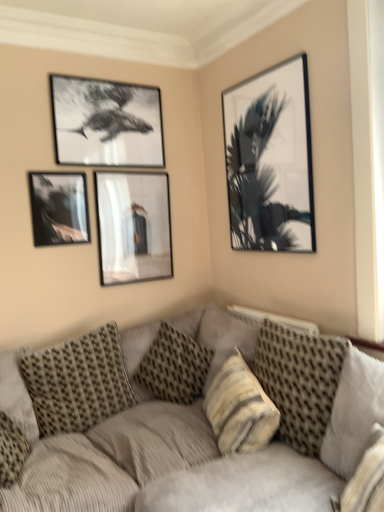
Question: From the image's perspective, would you say textured beige pillow at lower left, which is the fifth pillow from right to left, is positioned over patterned fabric pillow at center, positioned as the third pillow in right-to-left order?

Choices:
 (A) yes
 (B) no

Answer: (B)

Question: Is textured beige pillow at lower left, arranged as the first pillow when viewed from the left, in front of patterned fabric pillow at center, which ranks as the third pillow in left-to-right order?

Choices:
 (A) no
 (B) yes

Answer: (B)

Question: Can you confirm if textured beige pillow at lower left, arranged as the first pillow when viewed from the left, is smaller than patterned fabric pillow at center, which ranks as the third pillow in left-to-right order?

Choices:
 (A) no
 (B) yes

Answer: (B)

Question: From a real-world perspective, is textured beige pillow at lower left, arranged as the first pillow when viewed from the left, physically above patterned fabric pillow at center, which ranks as the third pillow in left-to-right order?

Choices:
 (A) no
 (B) yes

Answer: (B)

Question: Is patterned fabric pillow at center, which ranks as the third pillow in left-to-right order, completely or partially inside textured beige pillow at lower left, arranged as the first pillow when viewed from the left?

Choices:
 (A) no
 (B) yes

Answer: (A)

Question: In terms of size, does black matte picture frame at upper right, which appears as the first picture frame when viewed from the right, appear bigger or smaller than matte glass picture frame at center, which appears as the third picture frame when viewed from the left?

Choices:
 (A) big
 (B) small

Answer: (A)

Question: Looking at their shapes, would you say black matte picture frame at upper right, which appears as the first picture frame when viewed from the right, is wider or thinner than matte glass picture frame at center, which appears as the third picture frame when viewed from the left?

Choices:
 (A) thin
 (B) wide

Answer: (B)

Question: From a real-world perspective, is black matte picture frame at upper right, which is the fourth picture frame from left to right, above or below matte glass picture frame at center, which appears as the third picture frame when viewed from the left?

Choices:
 (A) below
 (B) above

Answer: (B)

Question: Is black matte picture frame at upper right, which appears as the first picture frame when viewed from the right, taller or shorter than matte glass picture frame at center, which appears as the third picture frame when viewed from the left?

Choices:
 (A) short
 (B) tall

Answer: (B)

Question: Based on their sizes in the image, would you say matte glass picture frame at center, placed as the second picture frame when sorted from right to left, is bigger or smaller than patterned fabric pillow at center, positioned as the third pillow in right-to-left order?

Choices:
 (A) small
 (B) big

Answer: (A)

Question: Is matte glass picture frame at center, placed as the second picture frame when sorted from right to left, wider or thinner than patterned fabric pillow at center, positioned as the third pillow in right-to-left order?

Choices:
 (A) thin
 (B) wide

Answer: (A)

Question: Considering the relative positions of matte glass picture frame at center, which appears as the third picture frame when viewed from the left, and patterned fabric pillow at center, which ranks as the third pillow in left-to-right order, in the image provided, is matte glass picture frame at center, which appears as the third picture frame when viewed from the left, to the left or to the right of patterned fabric pillow at center, which ranks as the third pillow in left-to-right order,?

Choices:
 (A) left
 (B) right

Answer: (A)

Question: Would you say matte glass picture frame at center, placed as the second picture frame when sorted from right to left, is inside or outside patterned fabric pillow at center, which ranks as the third pillow in left-to-right order?

Choices:
 (A) inside
 (B) outside

Answer: (B)

Question: Is striped fabric pillow at center, the second pillow viewed from the right, wider or thinner than matte glass picture frame at center, which appears as the third picture frame when viewed from the left?

Choices:
 (A) thin
 (B) wide

Answer: (B)

Question: Is striped fabric pillow at center, the second pillow viewed from the right, situated inside matte glass picture frame at center, placed as the second picture frame when sorted from right to left, or outside?

Choices:
 (A) inside
 (B) outside

Answer: (B)